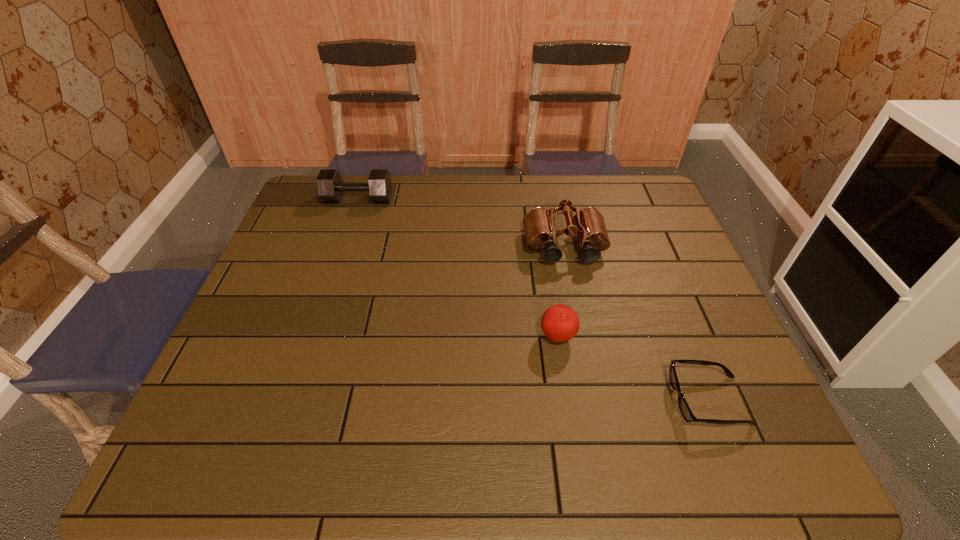
Identify the location of free space located on the lenses of the rightmost object. Image resolution: width=960 pixels, height=540 pixels. (606, 401).

Find the location of a particular element. The width and height of the screenshot is (960, 540). free point located 0.160m on the lenses of the rightmost object is located at coordinates (596, 401).

Where is `vacant space located 0.070m on the lenses of the rightmost object`? Image resolution: width=960 pixels, height=540 pixels. vacant space located 0.070m on the lenses of the rightmost object is located at coordinates (638, 401).

Identify the location of object that is at the far edge. This screenshot has width=960, height=540. (330, 187).

Locate an element on the screen. Image resolution: width=960 pixels, height=540 pixels. object positioned at the near edge is located at coordinates (684, 408).

Where is `object that is positioned at the left edge`? object that is positioned at the left edge is located at coordinates (330, 187).

Find the location of `object located at the right edge`. object located at the right edge is located at coordinates (684, 408).

Locate an element on the screen. object located at the far left corner is located at coordinates (330, 187).

Find the location of a particular element. The height and width of the screenshot is (540, 960). object present at the near right corner is located at coordinates (684, 408).

Identify the location of vacant space at the far edge of the desktop. coord(363,202).